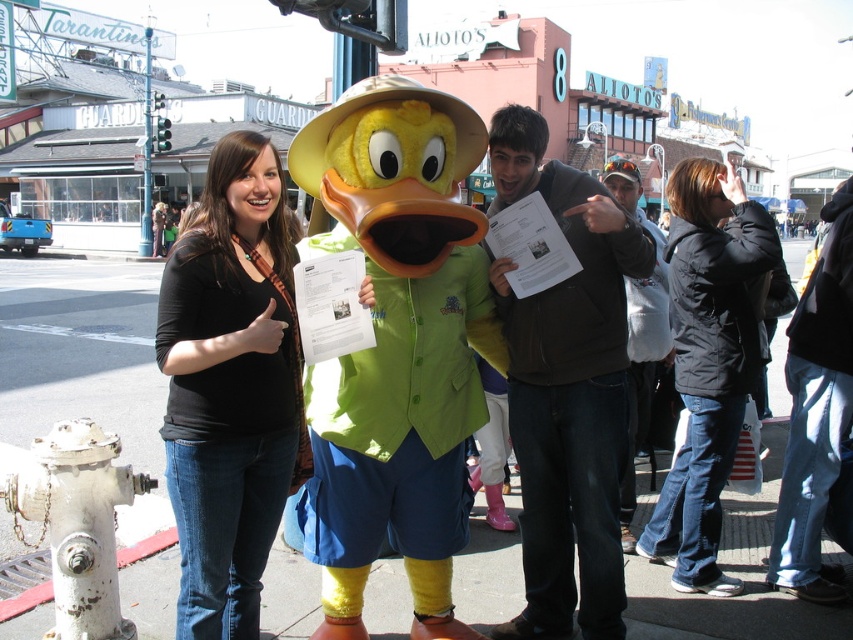
Question: Does dark brown hoodie at center have a lesser width compared to white metallic hydrant at lower left?

Choices:
 (A) no
 (B) yes

Answer: (A)

Question: Which point appears farthest from the camera in this image?

Choices:
 (A) (706, 428)
 (B) (335, 140)
 (C) (831, 204)
 (D) (225, 308)

Answer: (C)

Question: Does fluffy yellow duck at center appear on the left side of denim pants at lower right?

Choices:
 (A) no
 (B) yes

Answer: (B)

Question: Which point is farther from the camera taking this photo?

Choices:
 (A) (268, 449)
 (B) (833, 513)

Answer: (B)

Question: Does dark brown hoodie at center come in front of denim pants at lower right?

Choices:
 (A) no
 (B) yes

Answer: (B)

Question: Which object appears farthest from the camera in this image?

Choices:
 (A) dark brown hoodie at center
 (B) fluffy yellow duck at center
 (C) black fabric jacket at lower right
 (D) white metallic hydrant at lower left

Answer: (C)